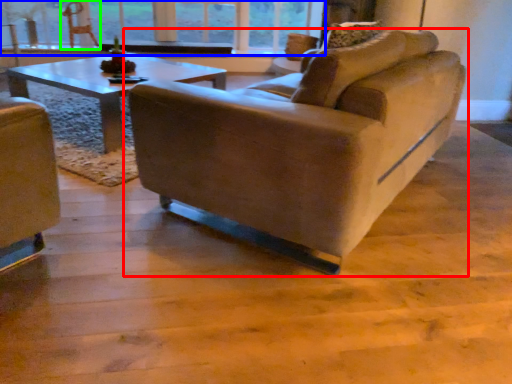
Question: Which is farther away from studio couch (highlighted by a red box)? window (highlighted by a blue box) or swivel chair (highlighted by a green box)?

Choices:
 (A) window
 (B) swivel chair

Answer: (B)